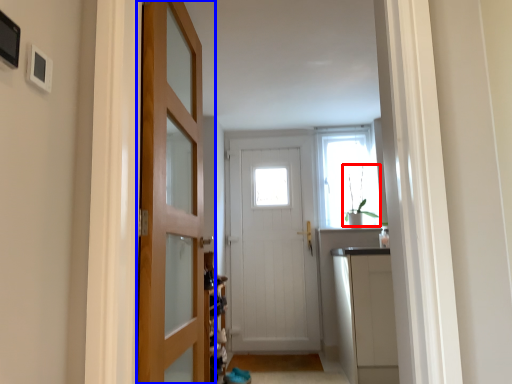
Question: Which object appears closest to the camera in this image, plant (highlighted by a red box) or door (highlighted by a blue box)?

Choices:
 (A) plant
 (B) door

Answer: (B)